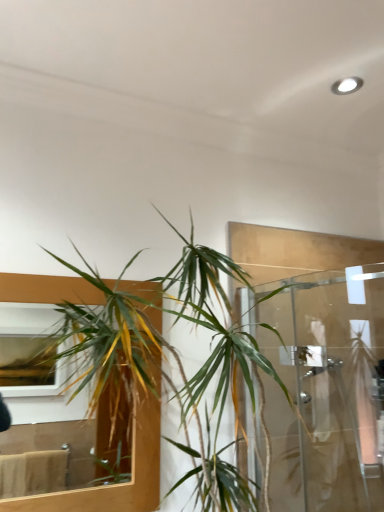
Question: From a real-world perspective, is green leafy plant at left physically above green leafy plant at center?

Choices:
 (A) yes
 (B) no

Answer: (B)

Question: From the image's perspective, does green leafy plant at left appear lower than green leafy plant at center?

Choices:
 (A) no
 (B) yes

Answer: (B)

Question: Considering the relative sizes of green leafy plant at left and green leafy plant at center in the image provided, is green leafy plant at left smaller than green leafy plant at center?

Choices:
 (A) no
 (B) yes

Answer: (B)

Question: Can you confirm if green leafy plant at left is bigger than green leafy plant at center?

Choices:
 (A) no
 (B) yes

Answer: (A)

Question: Is green leafy plant at left located outside green leafy plant at center?

Choices:
 (A) yes
 (B) no

Answer: (A)

Question: Relative to green leafy plant at left, is green leafy plant at center in front or behind?

Choices:
 (A) front
 (B) behind

Answer: (A)

Question: From the image's perspective, relative to green leafy plant at left, is green leafy plant at center above or below?

Choices:
 (A) below
 (B) above

Answer: (B)

Question: From a real-world perspective, is green leafy plant at center physically located above or below green leafy plant at left?

Choices:
 (A) below
 (B) above

Answer: (B)

Question: Considering the positions of green leafy plant at center and green leafy plant at left in the image, is green leafy plant at center bigger or smaller than green leafy plant at left?

Choices:
 (A) big
 (B) small

Answer: (A)

Question: From a real-world perspective, is clear glass shower door at right above or below green leafy plant at center?

Choices:
 (A) below
 (B) above

Answer: (A)

Question: From the image's perspective, relative to green leafy plant at center, is clear glass shower door at right above or below?

Choices:
 (A) above
 (B) below

Answer: (B)

Question: Does point (251, 436) appear closer or farther from the camera than point (235, 379)?

Choices:
 (A) closer
 (B) farther

Answer: (B)

Question: In the image, is clear glass shower door at right on the left side or the right side of green leafy plant at center?

Choices:
 (A) left
 (B) right

Answer: (B)

Question: Looking at the image, does green leafy plant at left seem bigger or smaller compared to clear glass shower door at right?

Choices:
 (A) big
 (B) small

Answer: (B)

Question: Is green leafy plant at left in front of or behind clear glass shower door at right in the image?

Choices:
 (A) front
 (B) behind

Answer: (B)